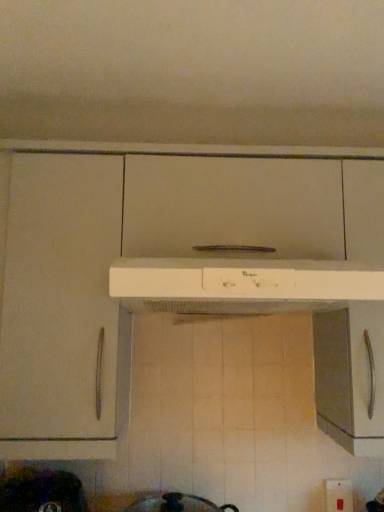
Question: Is white plastic electric outlet at lower right touching white plastic range hood at center?

Choices:
 (A) yes
 (B) no

Answer: (B)

Question: Is white plastic electric outlet at lower right bigger than white plastic range hood at center?

Choices:
 (A) no
 (B) yes

Answer: (A)

Question: Is there a large distance between white plastic electric outlet at lower right and white plastic range hood at center?

Choices:
 (A) yes
 (B) no

Answer: (B)

Question: Could white plastic range hood at center be considered to be inside white plastic electric outlet at lower right?

Choices:
 (A) yes
 (B) no

Answer: (B)

Question: From a real-world perspective, does white plastic electric outlet at lower right stand above white plastic range hood at center?

Choices:
 (A) no
 (B) yes

Answer: (A)

Question: Does white plastic electric outlet at lower right turn towards white plastic range hood at center?

Choices:
 (A) yes
 (B) no

Answer: (B)

Question: From the image's perspective, does metallic dark gray pot at lower left appear higher than white plastic range hood at center?

Choices:
 (A) yes
 (B) no

Answer: (B)

Question: Is metallic dark gray pot at lower left to the right of white plastic range hood at center from the viewer's perspective?

Choices:
 (A) yes
 (B) no

Answer: (B)

Question: Is the position of metallic dark gray pot at lower left less distant than that of white plastic range hood at center?

Choices:
 (A) no
 (B) yes

Answer: (A)

Question: Is metallic dark gray pot at lower left positioned with its back to white plastic range hood at center?

Choices:
 (A) yes
 (B) no

Answer: (B)

Question: Does metallic dark gray pot at lower left have a greater width compared to white plastic range hood at center?

Choices:
 (A) yes
 (B) no

Answer: (B)

Question: From a real-world perspective, is metallic dark gray pot at lower left physically below white plastic range hood at center?

Choices:
 (A) yes
 (B) no

Answer: (A)

Question: Can you confirm if white plastic range hood at center is bigger than metallic dark gray pot at lower left?

Choices:
 (A) no
 (B) yes

Answer: (B)